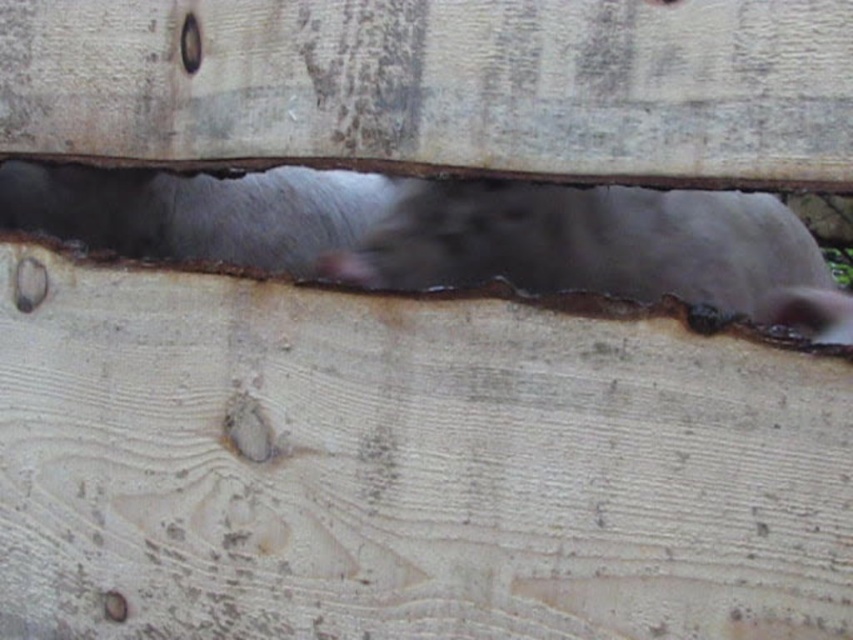
You are a carpenter inspecting a wooden structure. You notice a point at coordinates [442,86] which is part of a smooth wood plank at center. Is this point located on the smooth wood plank at center?

Yes, the point at [442,86] is part of the smooth wood plank at center.

You are an inspector checking the wooden structure. You notice the smooth wood plank at center and the brushed metal hole at upper center. Which object is nearer to you?

The smooth wood plank at center is closer to the viewer than the brushed metal hole at upper center.